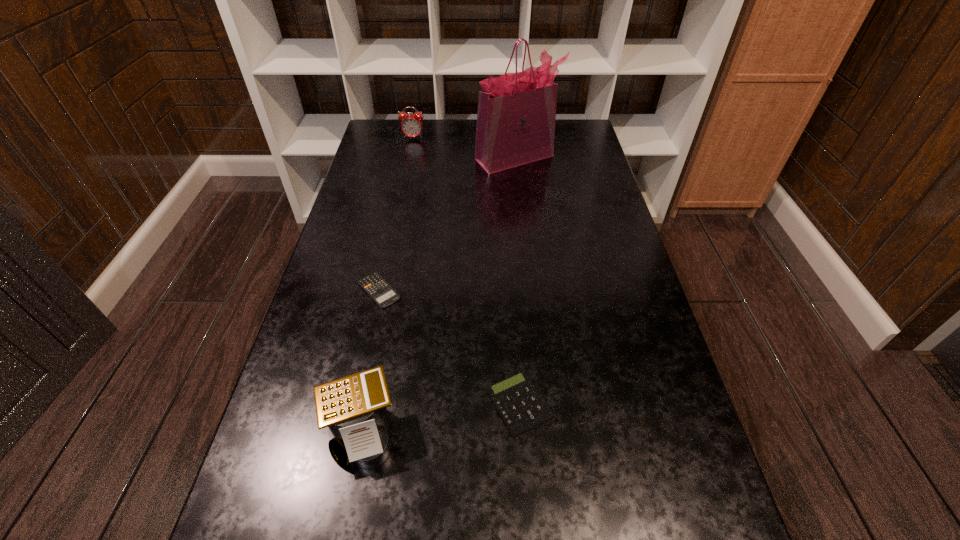
Image resolution: width=960 pixels, height=540 pixels. I want to click on the fourth nearest object, so click(516, 117).

Locate an element on the screen. the tallest object is located at coordinates (516, 117).

Image resolution: width=960 pixels, height=540 pixels. I want to click on the farthest object, so tap(411, 126).

Where is `the tallest calculator`? This screenshot has height=540, width=960. the tallest calculator is located at coordinates (353, 406).

Image resolution: width=960 pixels, height=540 pixels. I want to click on the second tallest calculator, so click(521, 407).

The image size is (960, 540). What are the coordinates of `the second shortest object` in the screenshot? It's located at (521, 407).

Identify the location of the shortest object. The width and height of the screenshot is (960, 540). (374, 285).

You are a GUI agent. You are given a task and a screenshot of the screen. Output one action in this format:
    pyautogui.click(x=<x>, y=<y>)
    Task: Click on the third farthest object
    
    Given the screenshot: What is the action you would take?
    pyautogui.click(x=374, y=285)

Find the location of a particular element. The height and width of the screenshot is (540, 960). free spot located on the front of the second farthest object is located at coordinates (524, 237).

You are a GUI agent. You are given a task and a screenshot of the screen. Output one action in this format:
    pyautogui.click(x=<x>, y=<y>)
    Task: Click on the blank space located on the face of the farthest object
    The height and width of the screenshot is (540, 960).
    Given the screenshot: What is the action you would take?
    pyautogui.click(x=399, y=204)